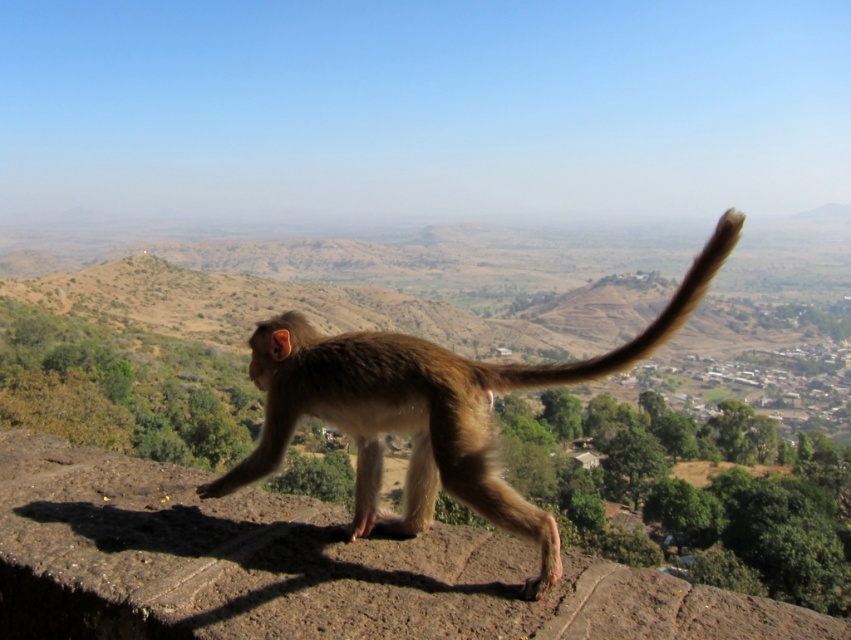
Question: Can you confirm if brown furry monkey at center is wider than brown furry tail at center?

Choices:
 (A) no
 (B) yes

Answer: (A)

Question: Is brown furry monkey at center below brown furry tail at center?

Choices:
 (A) no
 (B) yes

Answer: (B)

Question: Which of the following is the farthest from the observer?

Choices:
 (A) brown furry monkey at center
 (B) brown furry tail at center

Answer: (A)

Question: Is brown furry monkey at center thinner than brown furry tail at center?

Choices:
 (A) yes
 (B) no

Answer: (A)